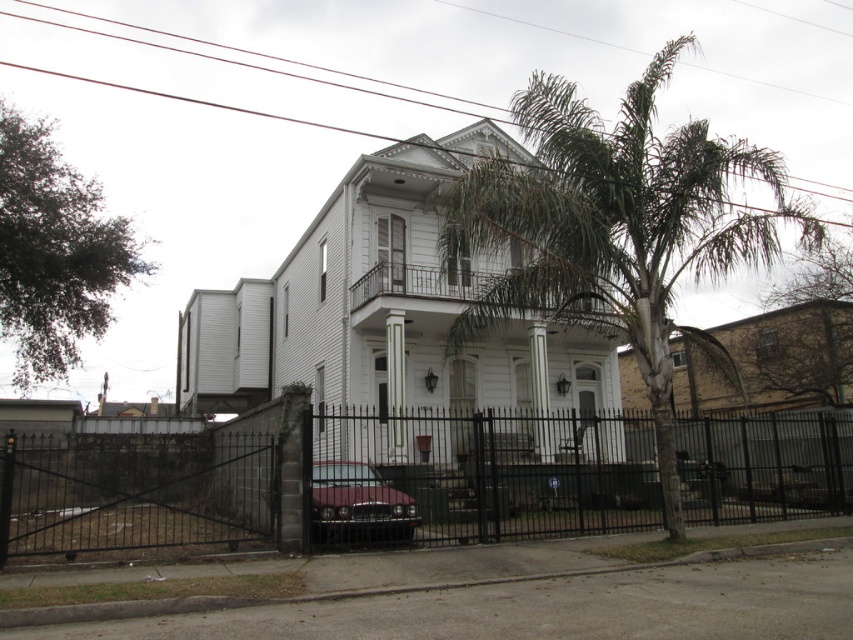
Consider the image. Which is more to the right, green leafy palm tree at center or shiny maroon car at center?

Positioned to the right is green leafy palm tree at center.

Measure the distance between point [788,209] and camera.

A distance of 38.60 feet exists between point [788,209] and camera.

Is point (531, 163) farther from viewer compared to point (361, 531)?

Yes.

You are a GUI agent. You are given a task and a screenshot of the screen. Output one action in this format:
    pyautogui.click(x=<x>, y=<y>)
    Task: Click on the green leafy palm tree at center
    This screenshot has width=853, height=640.
    Given the screenshot: What is the action you would take?
    pyautogui.click(x=614, y=228)

Is black metal fence at center bigger than shiny maroon car at center?

Indeed, black metal fence at center has a larger size compared to shiny maroon car at center.

This screenshot has width=853, height=640. In order to click on black metal fence at center in this screenshot , I will do `click(477, 490)`.

Who is more distant from viewer, (x=26, y=552) or (x=415, y=509)?

Point (x=415, y=509)

Image resolution: width=853 pixels, height=640 pixels. What are the coordinates of `black metal fence at center` in the screenshot? It's located at (477, 490).

Who is higher up, black metal fence at center or green leafy palm tree at center?

green leafy palm tree at center is higher up.

Which is more to the left, black metal fence at center or green leafy palm tree at center?

Positioned to the left is black metal fence at center.

Is point (762, 477) positioned in front of point (595, 240)?

That is False.

Locate an element on the screen. The width and height of the screenshot is (853, 640). black metal fence at center is located at coordinates (477, 490).